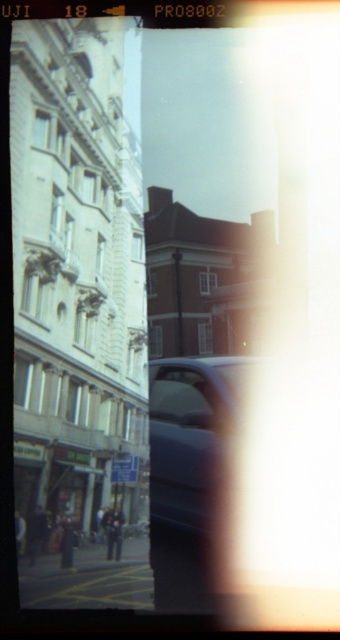
You are a photographer who wants to capture a closeup of the metallic blue car at center without including the transparent glass car window at center in the frame. Based on their sizes, is this possible?

The metallic blue car at center is taller than the transparent glass car window at center, so it is possible to capture a closeup of the metallic blue car at center without including the transparent glass car window at center by adjusting the camera angle to focus on the larger object.

You are standing in the street scene shown in the image. You notice two points marked in the photo. The first point is at coordinate point (x=213, y=481) and the second point is at coordinate point (x=161, y=381). Which of these two points is closer to you?

Point (x=213, y=481) is closer to the viewer than point (x=161, y=381).